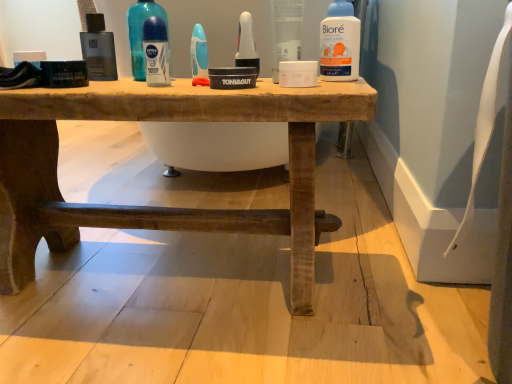
Question: Is white plastic toothbrush at center, which is the 1th mouthwash from right to left, taller than blue glossy deodorant at upper center, the second cleaning product from the front?

Choices:
 (A) no
 (B) yes

Answer: (A)

Question: Can you confirm if white plastic toothbrush at center, which is the 1th mouthwash from right to left, is bigger than blue glossy deodorant at upper center, the first cleaning product in the left-to-right sequence?

Choices:
 (A) yes
 (B) no

Answer: (B)

Question: Is white plastic toothbrush at center, which is the 1th mouthwash from right to left, beside blue glossy deodorant at upper center, the second cleaning product from the front?

Choices:
 (A) yes
 (B) no

Answer: (B)

Question: Is white plastic toothbrush at center, which is the 1th mouthwash from right to left, at the right side of blue glossy deodorant at upper center, arranged as the 2th cleaning product when viewed from the right?

Choices:
 (A) yes
 (B) no

Answer: (A)

Question: Is white plastic toothbrush at center, the 4th mouthwash in the left-to-right sequence, oriented towards blue glossy deodorant at upper center, the second cleaning product from the front?

Choices:
 (A) yes
 (B) no

Answer: (A)

Question: Does white plastic toothbrush at center, the 4th mouthwash in the left-to-right sequence, have a smaller size compared to blue glossy deodorant at upper center, the first cleaning product in the left-to-right sequence?

Choices:
 (A) yes
 (B) no

Answer: (A)

Question: Considering the relative sizes of blue glossy mouthwash at center, the 2th mouthwash viewed from the right, and rustic wood table at center in the image provided, is blue glossy mouthwash at center, the 2th mouthwash viewed from the right, taller than rustic wood table at center?

Choices:
 (A) yes
 (B) no

Answer: (B)

Question: Is blue glossy mouthwash at center, the 3th mouthwash viewed from the left, to the left of rustic wood table at center from the viewer's perspective?

Choices:
 (A) yes
 (B) no

Answer: (B)

Question: From a real-world perspective, does blue glossy mouthwash at center, the 2th mouthwash viewed from the right, sit lower than rustic wood table at center?

Choices:
 (A) yes
 (B) no

Answer: (B)

Question: Can you confirm if blue glossy mouthwash at center, the 2th mouthwash viewed from the right, is wider than rustic wood table at center?

Choices:
 (A) yes
 (B) no

Answer: (B)

Question: Is blue glossy mouthwash at center, the 3th mouthwash viewed from the left, positioned far away from rustic wood table at center?

Choices:
 (A) no
 (B) yes

Answer: (A)

Question: From a real-world perspective, is blue glossy mouthwash at center, the 3th mouthwash viewed from the left, located higher than rustic wood table at center?

Choices:
 (A) yes
 (B) no

Answer: (A)

Question: From a real-world perspective, is rustic wood table at center physically above white plastic biore at upper center, placed as the 1th cleaning product when sorted from front to back?

Choices:
 (A) no
 (B) yes

Answer: (A)